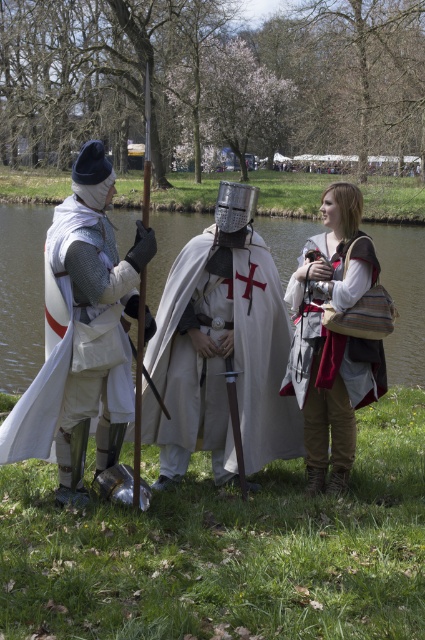
Based on the coordinates provided, what object is located at point (22, 292) in the image?

The white cloth cape at center is located at point (22, 292).

You are a costume designer assessing the image. Which of the two capes at the center, the white matte cape at center or the white cloth cape at center, is shorter?

The white matte cape at center is shorter than the white cloth cape at center.